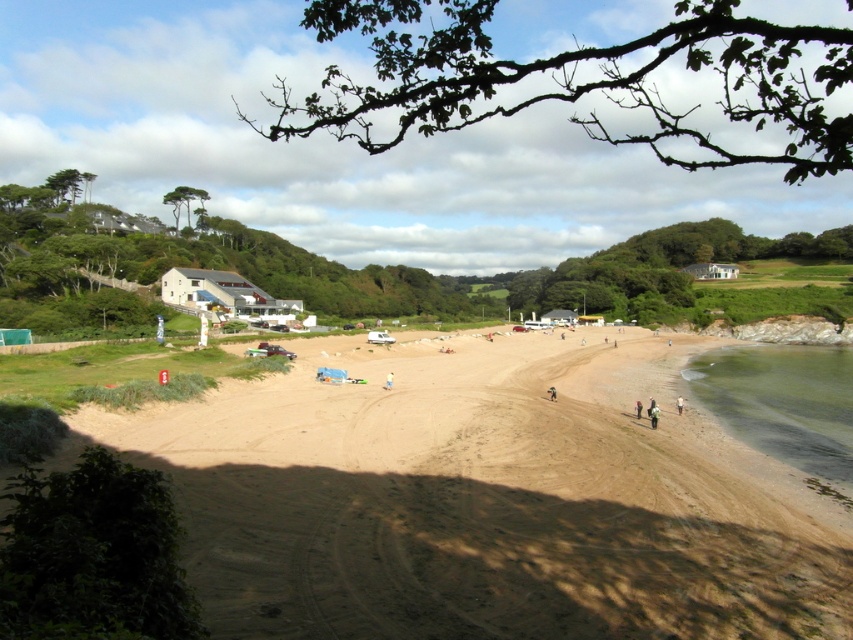
Question: Which object is farther from the camera taking this photo?

Choices:
 (A) brown sand at center
 (B) dark brown leather jacket at center
 (C) light brown sand at lower right
 (D) green fabric jacket at lower right

Answer: (C)

Question: Which object is the closest to the brown sand at center?

Choices:
 (A) yellow fabric at center
 (B) green fabric jacket at lower right
 (C) clear water at lower right

Answer: (A)

Question: From the image, what is the correct spatial relationship of yellow fabric at center in relation to light brown sand at lower right?

Choices:
 (A) above
 (B) below

Answer: (A)

Question: Is green fabric jacket at lower right wider than yellow fabric at center?

Choices:
 (A) yes
 (B) no

Answer: (A)

Question: Estimate the real-world distances between objects in this image. Which object is closer to the green fabric jacket at lower right?

Choices:
 (A) clear water at lower right
 (B) light brown sand at lower right
 (C) brown sand at center
 (D) yellow fabric at center

Answer: (B)

Question: Can you confirm if light brown sand at lower right is positioned below dark brown leather jacket at center?

Choices:
 (A) no
 (B) yes

Answer: (B)